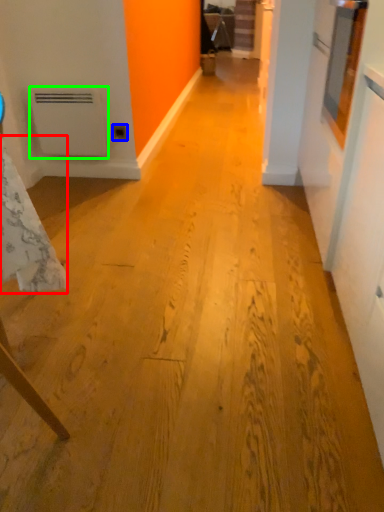
Question: Based on their relative distances, which object is farther from tablecloth (highlighted by a red box)? Choose from electric outlet (highlighted by a blue box) and water heater (highlighted by a green box).

Choices:
 (A) electric outlet
 (B) water heater

Answer: (A)